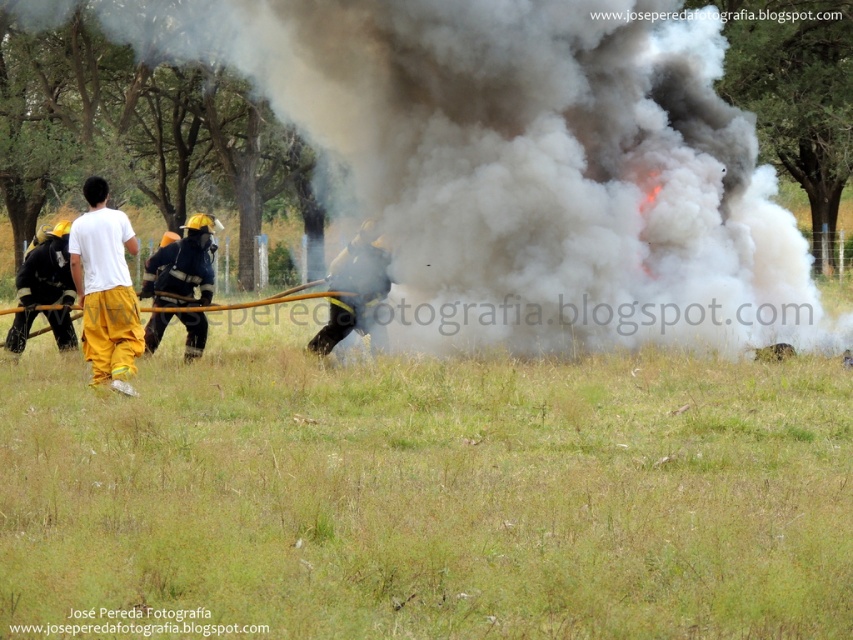
Question: Which point appears farthest from the camera in this image?

Choices:
 (A) (33, 280)
 (B) (305, 445)

Answer: (A)

Question: Does yellow fire helmet at center appear on the right side of black matte firefighter at center?

Choices:
 (A) no
 (B) yes

Answer: (A)

Question: Which of these objects is positioned farthest from the white cotton shirt at left?

Choices:
 (A) yellow matte helmet at upper center
 (B) black matte firefighter at center
 (C) yellow fire helmet at center
 (D) black smoke at center

Answer: (D)

Question: Which of these objects is positioned closest to the yellow matte helmet at upper center?

Choices:
 (A) yellow fire helmet at center
 (B) white cotton shirt at left
 (C) black smoke at center

Answer: (A)

Question: Is yellow fire helmet at center to the left of yellow matte helmet at upper center from the viewer's perspective?

Choices:
 (A) no
 (B) yes

Answer: (A)

Question: Where is green grass at center located in relation to black matte firefighter at center in the image?

Choices:
 (A) above
 (B) below

Answer: (B)